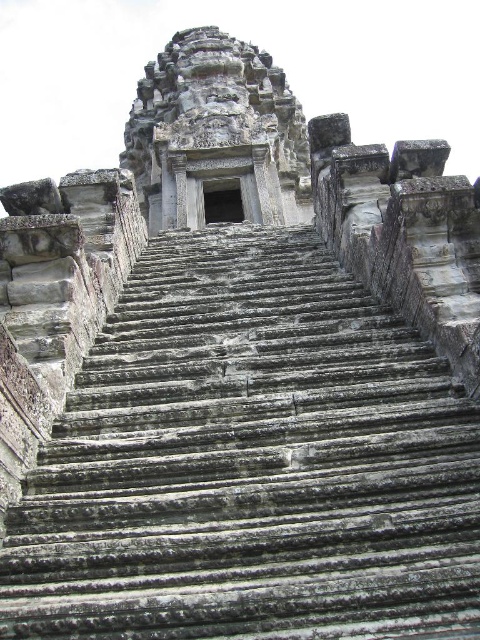
Based on the photo, does gray stone stairs at center appear on the right side of gray stone temple at center?

Indeed, gray stone stairs at center is positioned on the right side of gray stone temple at center.

Is gray stone stairs at center behind gray stone temple at center?

No, it is not.

Between point (444, 634) and point (149, 221), which one is positioned behind?

The point (149, 221) is behind.

Identify the location of gray stone stairs at center. (250, 461).